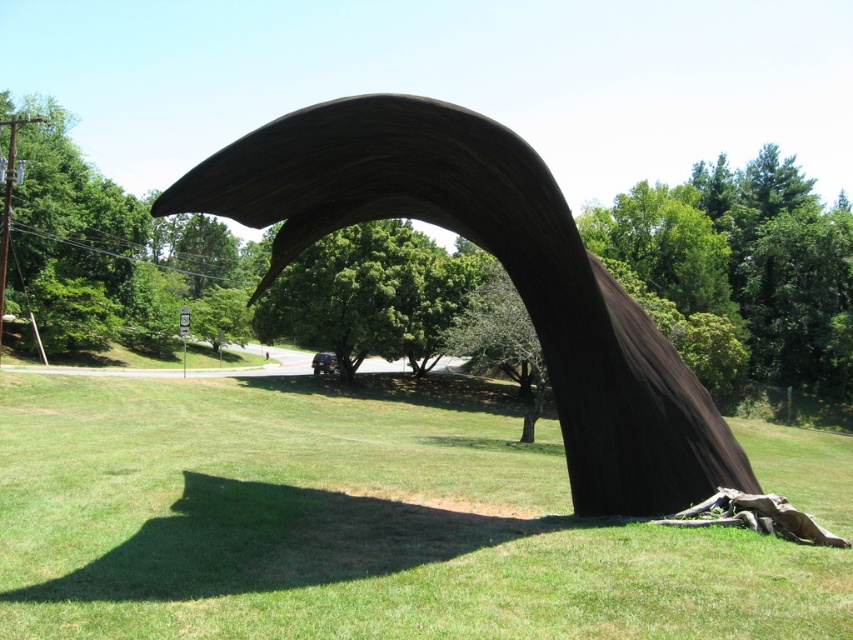
Question: Considering the relative positions of green grass at center and rustic wood arch at center in the image provided, where is green grass at center located with respect to rustic wood arch at center?

Choices:
 (A) right
 (B) left

Answer: (B)

Question: Which point is closer to the camera?

Choices:
 (A) green grass at center
 (B) rustic wood arch at center

Answer: (A)

Question: Does green grass at center have a greater width compared to rustic wood arch at center?

Choices:
 (A) no
 (B) yes

Answer: (B)

Question: Can you confirm if green grass at center is positioned to the left of rustic wood arch at center?

Choices:
 (A) yes
 (B) no

Answer: (A)